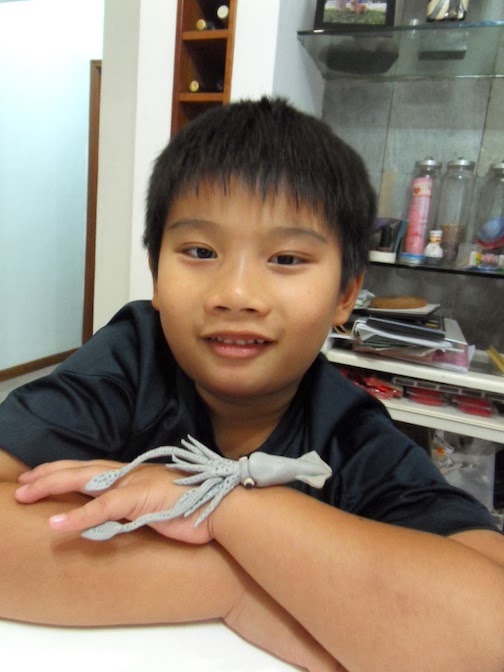
The height and width of the screenshot is (672, 504). What are the coordinates of `tall glass jars, top right side` in the screenshot? It's located at (483, 200), (464, 204), (428, 209).